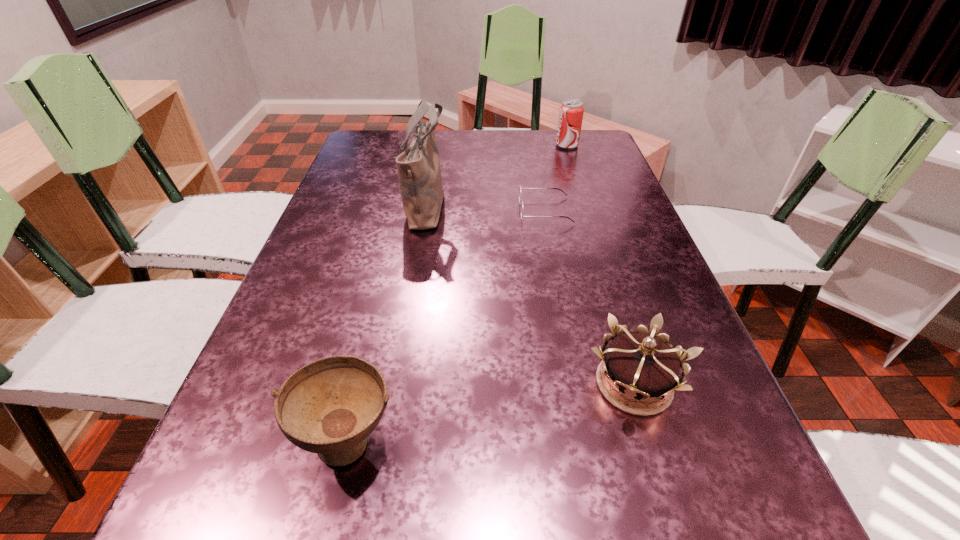
Locate an element on the screen. The image size is (960, 540). vacant space at the far left corner of the desktop is located at coordinates (383, 148).

Locate an element on the screen. The height and width of the screenshot is (540, 960). free space between the shortest object and the crown is located at coordinates (589, 297).

You are a GUI agent. You are given a task and a screenshot of the screen. Output one action in this format:
    pyautogui.click(x=<x>, y=<y>)
    Task: Click on the free space between the spectacles and the crown
    The height and width of the screenshot is (540, 960).
    Given the screenshot: What is the action you would take?
    pyautogui.click(x=589, y=297)

This screenshot has width=960, height=540. I want to click on vacant region between the tallest object and the farthest object, so click(497, 176).

Locate an element on the screen. empty space that is in between the shoulder bag and the soda can is located at coordinates (497, 176).

Image resolution: width=960 pixels, height=540 pixels. Identify the location of vacant area that lies between the crown and the farthest object. (600, 265).

Where is `vacant space that is in between the crown and the soup bowl`? vacant space that is in between the crown and the soup bowl is located at coordinates pyautogui.click(x=492, y=411).

You are a GUI agent. You are given a task and a screenshot of the screen. Output one action in this format:
    pyautogui.click(x=<x>, y=<y>)
    Task: Click on the unoccupied area between the shortest object and the shoulder bag
    The width and height of the screenshot is (960, 540).
    Given the screenshot: What is the action you would take?
    tap(486, 208)

At what (x,y) coordinates should I click in order to perform the action: click on empty location between the soup bowl and the spectacles. Please return your answer as a coordinate pair (x, y). The image size is (960, 540). Looking at the image, I should click on (446, 325).

The width and height of the screenshot is (960, 540). In order to click on free space between the crown and the spectacles in this screenshot , I will do `click(589, 297)`.